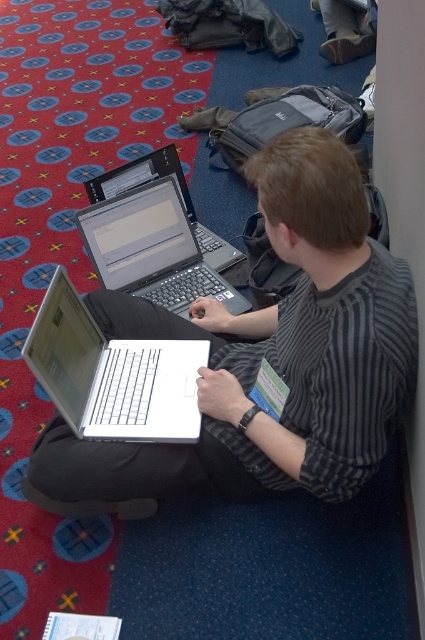
Who is taller, white plastic laptop at center or silver/black keyboard at center?

white plastic laptop at center is taller.

How distant is white plastic laptop at center from silver/black keyboard at center?

white plastic laptop at center is 15.42 inches from silver/black keyboard at center.

Find the location of a particular element. white plastic laptop at center is located at coordinates (266, 358).

Measure the distance between white matte laptop at center and silver/black keyboard at center.

The distance of white matte laptop at center from silver/black keyboard at center is 40.98 centimeters.

Can you confirm if white matte laptop at center is positioned above silver/black keyboard at center?

Incorrect, white matte laptop at center is not positioned above silver/black keyboard at center.

Locate an element on the screen. This screenshot has width=425, height=640. white matte laptop at center is located at coordinates [x=113, y=374].

Is white plastic laptop at center below white matte laptop at center?

Incorrect, white plastic laptop at center is not positioned below white matte laptop at center.

Who is more forward, (x=374, y=244) or (x=107, y=406)?

Point (x=374, y=244) is more forward.

This screenshot has height=640, width=425. What are the coordinates of `white plastic laptop at center` in the screenshot? It's located at [x=266, y=358].